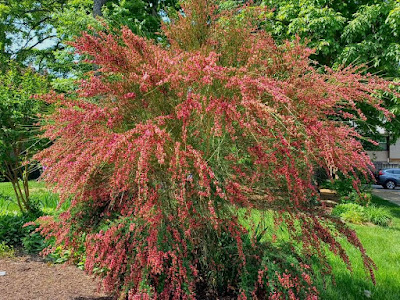
The image size is (400, 300). In order to click on bench in this screenshot , I will do `click(329, 193)`.